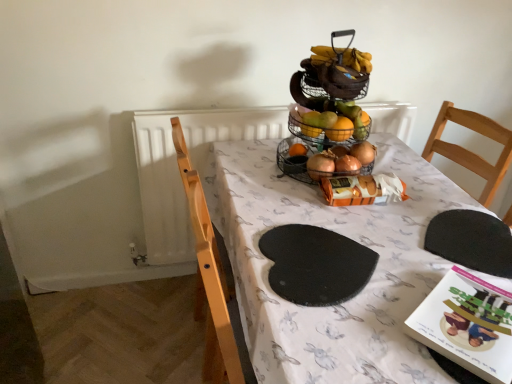
Question: Considering the positions of black rubber placemat at lower right, positioned as the 2th mat in left-to-right order, and black felt mat at center, which ranks as the second mat in right-to-left order, in the image, is black rubber placemat at lower right, positioned as the 2th mat in left-to-right order, bigger or smaller than black felt mat at center, which ranks as the second mat in right-to-left order,?

Choices:
 (A) big
 (B) small

Answer: (B)

Question: Relative to black felt mat at center, which ranks as the second mat in right-to-left order, is black rubber placemat at lower right, positioned as the 2th mat in left-to-right order, in front or behind?

Choices:
 (A) front
 (B) behind

Answer: (B)

Question: Based on their relative distances, which object is nearer to the black felt mat at center, which ranks as the first mat in left-to-right order?

Choices:
 (A) black rubber placemat at lower right, positioned as the 2th mat in left-to-right order
 (B) wire mesh basket at center
 (C) white paper book at lower right
 (D) white fabric table at center

Answer: (D)

Question: Estimate the real-world distances between objects in this image. Which object is closer to the black rubber placemat at lower right, which is counted as the first mat, starting from the right?

Choices:
 (A) white fabric table at center
 (B) wire mesh basket at center
 (C) white paper book at lower right
 (D) black felt mat at center, which ranks as the first mat in left-to-right order

Answer: (C)